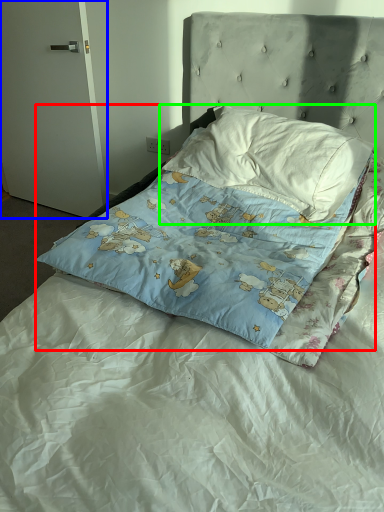
Question: Estimate the real-world distances between objects in this image. Which object is closer to pillow (highlighted by a red box), door (highlighted by a blue box) or pillow (highlighted by a green box)?

Choices:
 (A) door
 (B) pillow

Answer: (B)